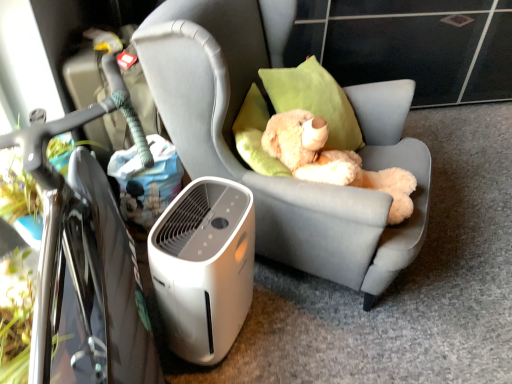
Question: From a real-world perspective, is light gray fabric chair at center positioned over black glossy bicycle at left based on gravity?

Choices:
 (A) no
 (B) yes

Answer: (B)

Question: Is light gray fabric chair at center not near black glossy bicycle at left?

Choices:
 (A) yes
 (B) no

Answer: (B)

Question: From the image's perspective, does light gray fabric chair at center appear lower than black glossy bicycle at left?

Choices:
 (A) no
 (B) yes

Answer: (A)

Question: Considering the relative positions of light gray fabric chair at center and black glossy bicycle at left in the image provided, is light gray fabric chair at center to the left of black glossy bicycle at left from the viewer's perspective?

Choices:
 (A) yes
 (B) no

Answer: (B)

Question: Does light gray fabric chair at center touch black glossy bicycle at left?

Choices:
 (A) yes
 (B) no

Answer: (B)

Question: Is light gray fabric chair at center bigger than black glossy bicycle at left?

Choices:
 (A) no
 (B) yes

Answer: (B)

Question: Is fluffy beige teddy bear at center facing towards black glossy bicycle at left?

Choices:
 (A) no
 (B) yes

Answer: (A)

Question: Considering the relative sizes of fluffy beige teddy bear at center and black glossy bicycle at left in the image provided, is fluffy beige teddy bear at center smaller than black glossy bicycle at left?

Choices:
 (A) yes
 (B) no

Answer: (A)

Question: Considering the relative sizes of fluffy beige teddy bear at center and black glossy bicycle at left in the image provided, is fluffy beige teddy bear at center shorter than black glossy bicycle at left?

Choices:
 (A) yes
 (B) no

Answer: (A)

Question: Is fluffy beige teddy bear at center positioned beyond the bounds of black glossy bicycle at left?

Choices:
 (A) yes
 (B) no

Answer: (A)

Question: Can you confirm if fluffy beige teddy bear at center is thinner than black glossy bicycle at left?

Choices:
 (A) yes
 (B) no

Answer: (B)

Question: Considering the relative positions of fluffy beige teddy bear at center and black glossy bicycle at left in the image provided, is fluffy beige teddy bear at center to the left of black glossy bicycle at left from the viewer's perspective?

Choices:
 (A) yes
 (B) no

Answer: (B)

Question: Does fluffy beige teddy bear at center appear on the left side of white plastic air purifier at lower left?

Choices:
 (A) yes
 (B) no

Answer: (B)